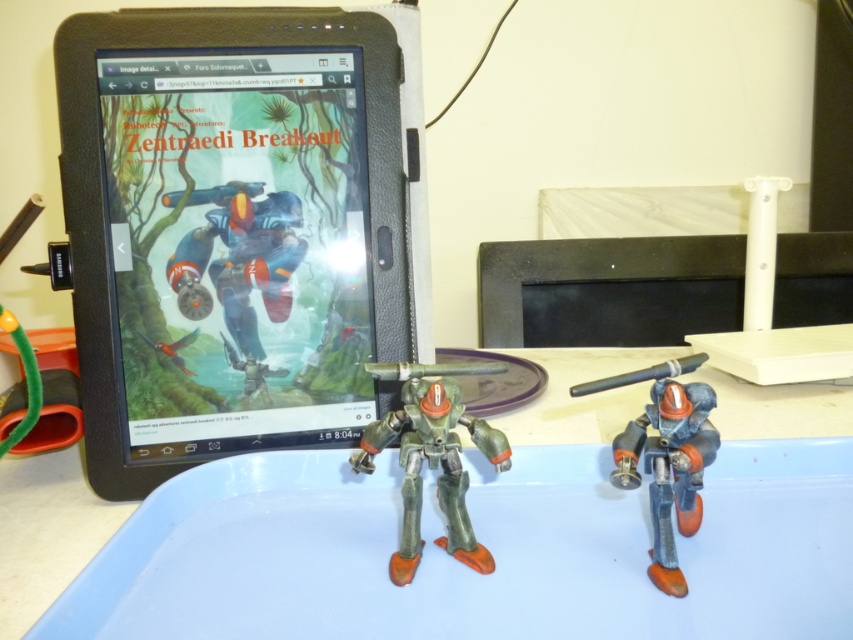
Who is more distant from viewer, (369, 202) or (714, 396)?

Point (369, 202)

Image resolution: width=853 pixels, height=640 pixels. What do you see at coordinates (230, 230) in the screenshot?
I see `black matte tablet at upper left` at bounding box center [230, 230].

Is point (143, 19) closer to camera compared to point (677, 371)?

That is False.

Image resolution: width=853 pixels, height=640 pixels. Find the location of `black matte tablet at upper left`. black matte tablet at upper left is located at coordinates (230, 230).

Can you confirm if black matte tablet at upper left is positioned above blue plastic tray at center?

Correct, black matte tablet at upper left is located above blue plastic tray at center.

Between point (112, 163) and point (12, 573), which one is positioned behind?

The point (112, 163) is more distant.

Where is `black matte tablet at upper left`? The width and height of the screenshot is (853, 640). black matte tablet at upper left is located at coordinates (230, 230).

Locate an element on the screen. Image resolution: width=853 pixels, height=640 pixels. black matte tablet at upper left is located at coordinates (230, 230).

Who is higher up, black matte tablet at upper left or green matte robot at center?

black matte tablet at upper left is above.

Between point (154, 362) and point (460, 493), which one is positioned behind?

The point (154, 362) is more distant.

Locate an element on the screen. The height and width of the screenshot is (640, 853). black matte tablet at upper left is located at coordinates (230, 230).